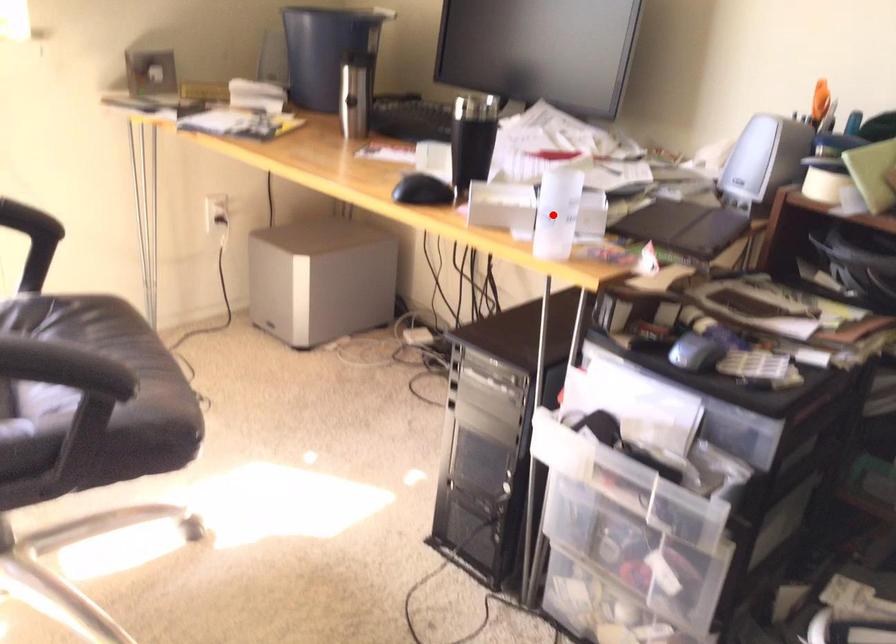
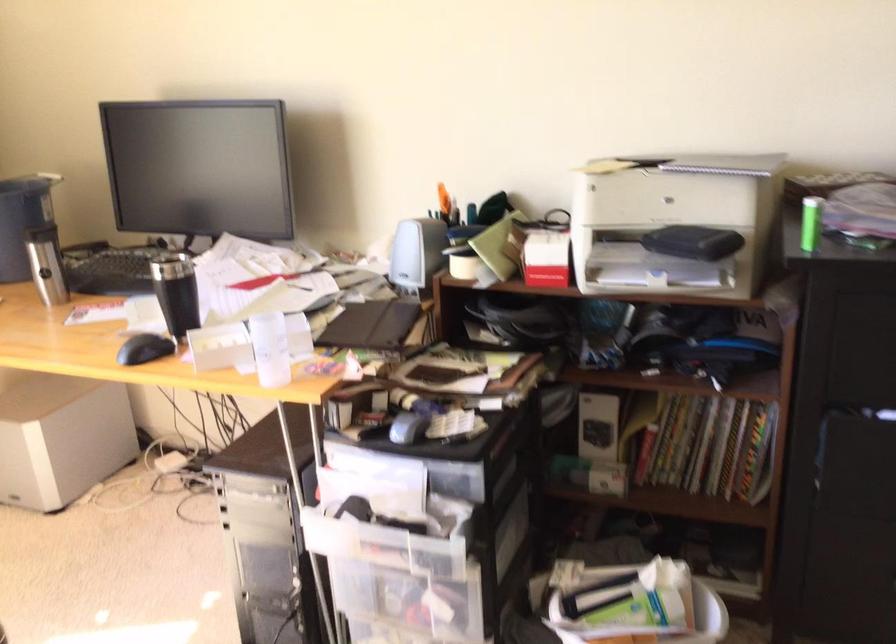
Where in the second image is the point corresponding to the highlighted location from the first image?

(270, 348)